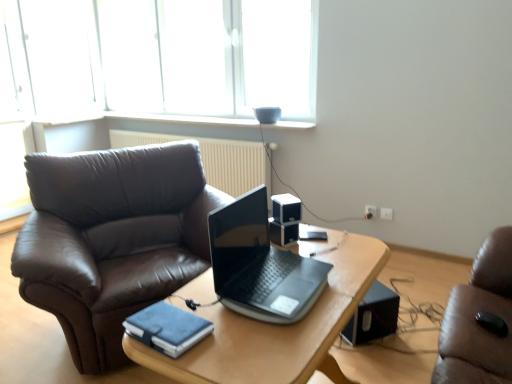
Find the location of `vacant space to the right of blue leather notebook at lower center`. vacant space to the right of blue leather notebook at lower center is located at coordinates (233, 337).